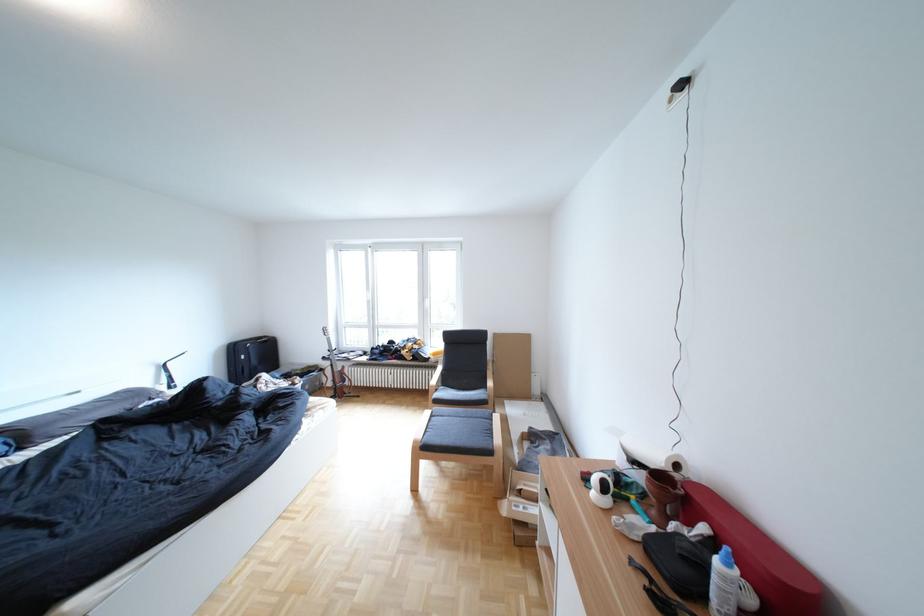
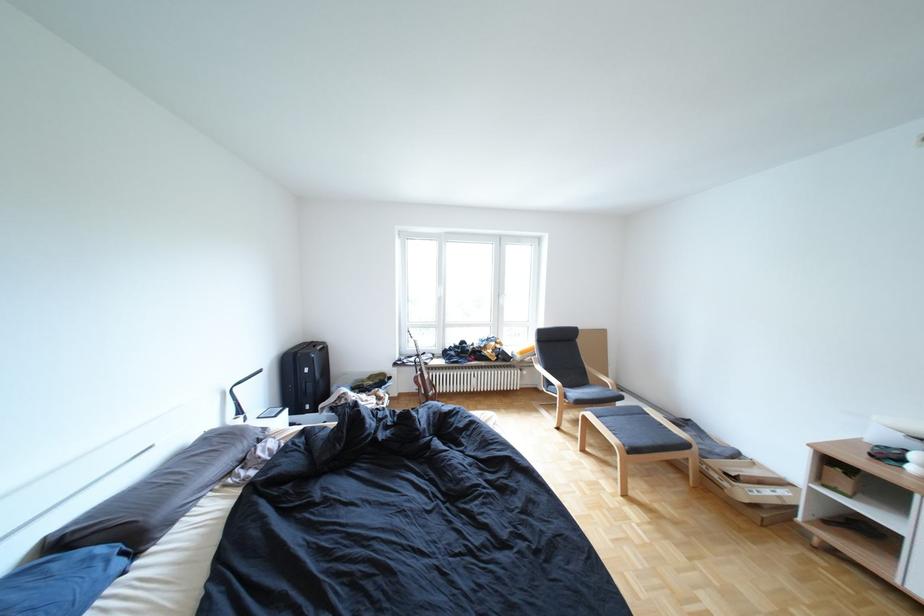
Question: In a continuous first-person perspective shot, in which direction is the camera moving?

Choices:
 (A) Left
 (B) Right
 (C) Forward
 (D) Backward

Answer: (A)